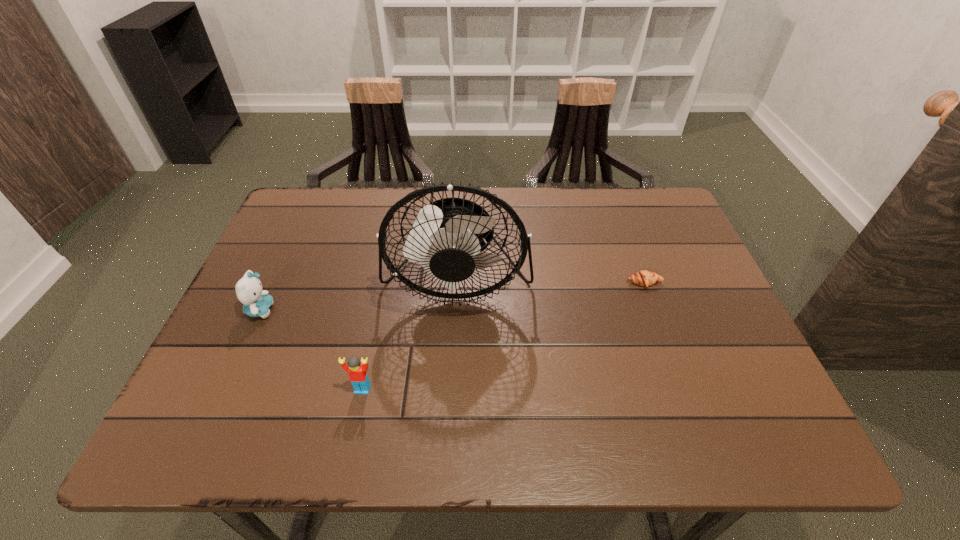
Where is `fan`? The image size is (960, 540). fan is located at coordinates pos(447,239).

What are the coordinates of `the leftmost object` in the screenshot? It's located at (256, 303).

Where is `Lego`? This screenshot has width=960, height=540. Lego is located at coordinates (357, 372).

Identify the location of the rightmost object. The image size is (960, 540). (644, 278).

Locate an element on the screen. pastry is located at coordinates (644, 278).

The image size is (960, 540). In order to click on vacant area located in front of the fan, directing airflow in this screenshot , I will do `click(450, 416)`.

The image size is (960, 540). I want to click on blank area located on the face of the leftmost object, so (395, 310).

I want to click on free region located 0.110m on the face of the nearest object, so click(x=349, y=449).

Find the location of a particular element. The width and height of the screenshot is (960, 540). free spot located on the front-facing side of the shortest object is located at coordinates (681, 382).

Locate an element on the screen. object situated at the left edge is located at coordinates (256, 303).